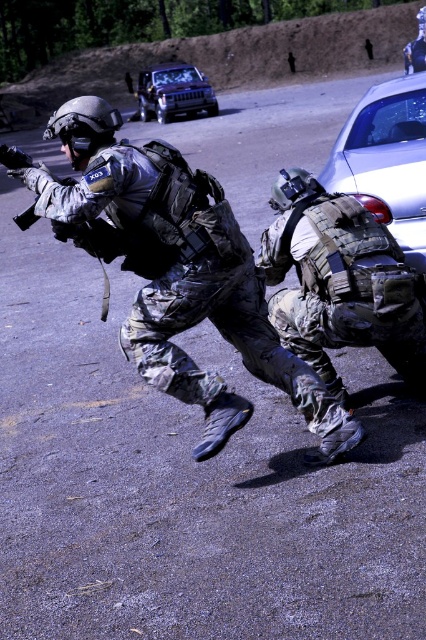
Is camouflage fabric uniform at center wider than metallic silver suv at upper center?

Incorrect, camouflage fabric uniform at center's width does not surpass metallic silver suv at upper center's.

Is camouflage fabric uniform at center below metallic silver suv at upper center?

Yes.

Where is `camouflage fabric uniform at center`? camouflage fabric uniform at center is located at coordinates (175, 272).

Is satin silver car at right wider than metallic silver suv at upper center?

In fact, satin silver car at right might be narrower than metallic silver suv at upper center.

Between satin silver car at right and metallic silver suv at upper center, which one has more height?

Standing taller between the two is metallic silver suv at upper center.

Measure the distance between satin silver car at right and camera.

satin silver car at right is 31.05 feet from camera.

You are a GUI agent. You are given a task and a screenshot of the screen. Output one action in this format:
    pyautogui.click(x=<x>, y=<y>)
    Task: Click on the satin silver car at right
    The height and width of the screenshot is (640, 426).
    Given the screenshot: What is the action you would take?
    pyautogui.click(x=386, y=161)

At what (x,y) coordinates should I click in order to perform the action: click on camouflage fabric uniform at center. Please return your answer as a coordinate pair (x, y). The image size is (426, 640). Looking at the image, I should click on (175, 272).

Does camouflage fabric uniform at center appear on the right side of satin silver car at right?

No, camouflage fabric uniform at center is not to the right of satin silver car at right.

Which is in front, point (69, 189) or point (380, 92)?

Point (69, 189) is more forward.

At what (x,y) coordinates should I click in order to perform the action: click on camouflage fabric uniform at center. Please return your answer as a coordinate pair (x, y). This screenshot has height=640, width=426. Looking at the image, I should click on (175, 272).